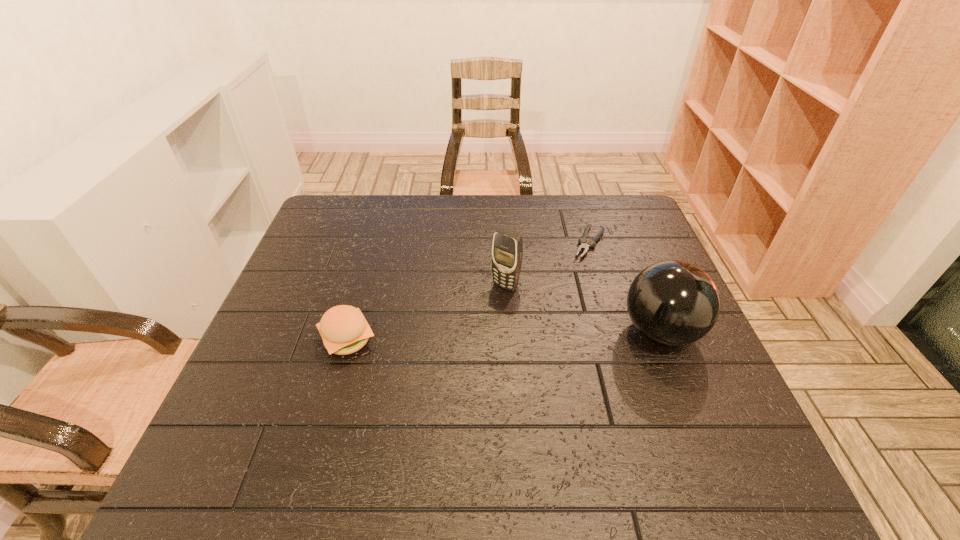
In order to click on hamburger in this screenshot , I will do `click(344, 330)`.

Locate an element on the screen. This screenshot has height=540, width=960. the second shortest object is located at coordinates (344, 330).

Locate an element on the screen. bowling ball is located at coordinates (674, 303).

Locate an element on the screen. The height and width of the screenshot is (540, 960). the farthest object is located at coordinates (583, 246).

At what (x,y) coordinates should I click in order to perform the action: click on pliers. Please return your answer as a coordinate pair (x, y). This screenshot has width=960, height=540. Looking at the image, I should click on (583, 246).

The width and height of the screenshot is (960, 540). Identify the location of the third nearest object. [507, 250].

I want to click on the second object from left to right, so click(507, 250).

Where is `free location located on the right of the third tallest object`? free location located on the right of the third tallest object is located at coordinates (523, 340).

Identify the location of free point located at the gripping part of the pliers. (540, 337).

You are a GUI agent. You are given a task and a screenshot of the screen. Output one action in this format:
    pyautogui.click(x=<x>, y=<y>)
    Task: Click on the vacant region located 0.110m at the gripping part of the pliers
    The height and width of the screenshot is (540, 960).
    Given the screenshot: What is the action you would take?
    pyautogui.click(x=572, y=281)